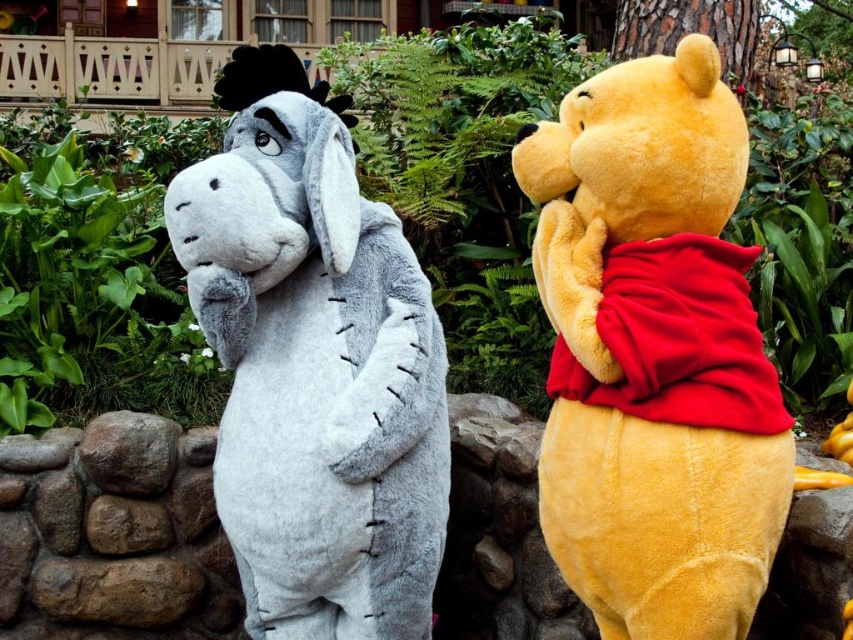
Question: Is soft yellow teddy bear at center positioned before fuzzy gray donkey at left?

Choices:
 (A) yes
 (B) no

Answer: (A)

Question: Which point appears farthest from the camera in this image?

Choices:
 (A) (691, 524)
 (B) (207, 257)

Answer: (B)

Question: Is soft yellow teddy bear at center bigger than fuzzy gray donkey at left?

Choices:
 (A) no
 (B) yes

Answer: (A)

Question: Can you confirm if soft yellow teddy bear at center is positioned above fuzzy gray donkey at left?

Choices:
 (A) yes
 (B) no

Answer: (A)

Question: Which of the following is the farthest from the observer?

Choices:
 (A) (258, 570)
 (B) (585, 490)

Answer: (A)

Question: Which object appears closest to the camera in this image?

Choices:
 (A) soft yellow teddy bear at center
 (B) fuzzy gray donkey at left

Answer: (A)